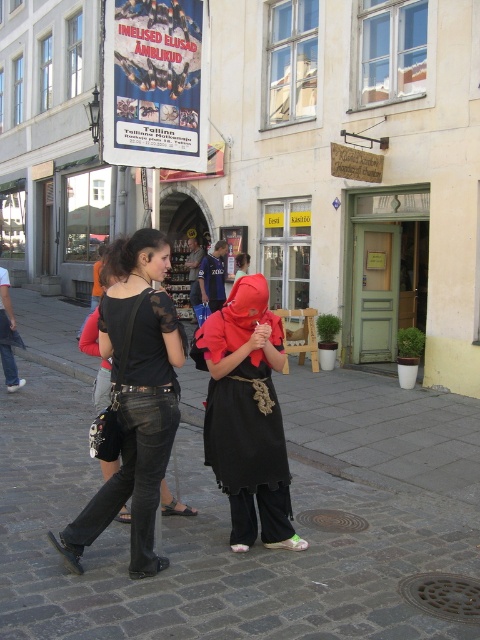
Question: Is matte red fabric at center thinner than matte black dress at center?

Choices:
 (A) no
 (B) yes

Answer: (A)

Question: Does cobblestone pavement at center appear over metallic poster at upper center?

Choices:
 (A) no
 (B) yes

Answer: (A)

Question: Considering the real-world distances, which object is farthest from the black leather pants at lower left?

Choices:
 (A) matte red fabric at center
 (B) matte black dress at center
 (C) metallic poster at upper center
 (D) cobblestone pavement at center

Answer: (B)

Question: Which point is farther to the camera?

Choices:
 (A) matte black dress at center
 (B) black leather pants at lower left
 (C) cobblestone pavement at center

Answer: (A)

Question: Can you confirm if cobblestone pavement at center is positioned to the left of matte red fabric at center?

Choices:
 (A) no
 (B) yes

Answer: (B)

Question: Estimate the real-world distances between objects in this image. Which object is farther from the matte red fabric at center?

Choices:
 (A) matte black dress at center
 (B) black leather pants at lower left
 (C) cobblestone pavement at center

Answer: (A)